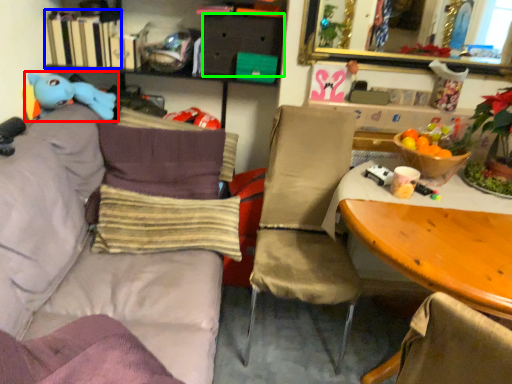
Question: Estimate the real-world distances between objects in this image. Which object is farther from toy (highlighted by a red box), book (highlighted by a blue box) or drawer (highlighted by a green box)?

Choices:
 (A) book
 (B) drawer

Answer: (B)